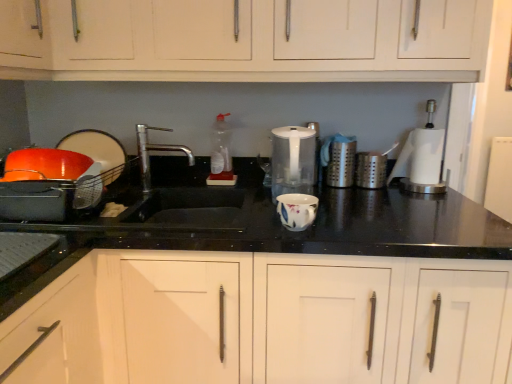
Question: Is matte black bowl at left, which is counted as the fourth appliance, starting from the right, in front of or behind satin silver canister at center right, the first appliance viewed from the right, in the image?

Choices:
 (A) behind
 (B) front

Answer: (B)

Question: In the image, is matte black bowl at left, which appears as the 2th appliance when viewed from the left, on the left side or the right side of satin silver canister at center right, the first appliance viewed from the right?

Choices:
 (A) left
 (B) right

Answer: (A)

Question: Estimate the real-world distances between objects in this image. Which object is closer to the white plastic blender at right?

Choices:
 (A) transparent plastic kettle at center, acting as the third appliance starting from the right
 (B) matte black bowl at left, which is counted as the fourth appliance, starting from the right
 (C) clear plastic bottle at center
 (D) white wood cabinet at center, the first cabinetry when ordered from bottom to top
 (E) orange matte bowl at left, which is counted as the 5th appliance, starting from the right

Answer: (A)

Question: Estimate the real-world distances between objects in this image. Which object is closer to the white plastic blender at right?

Choices:
 (A) white matte cabinet at upper center, which is the first cabinetry from top to bottom
 (B) clear plastic bottle at center
 (C) white wood cabinet at center, the first cabinetry when ordered from bottom to top
 (D) matte black bowl at left, which appears as the 2th appliance when viewed from the left
 (E) satin silver canister at center, the 4th appliance when ordered from left to right

Answer: (E)